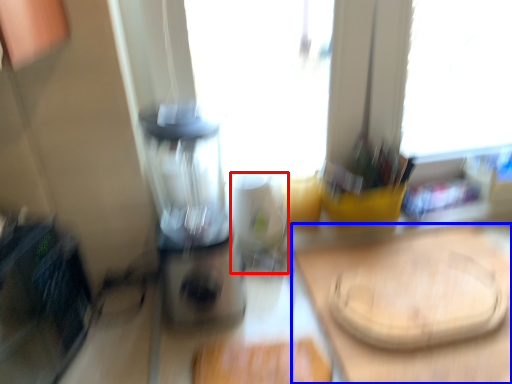
Question: Which object is closer to the camera taking this photo, appliance (highlighted by a red box) or counter top (highlighted by a blue box)?

Choices:
 (A) appliance
 (B) counter top

Answer: (B)